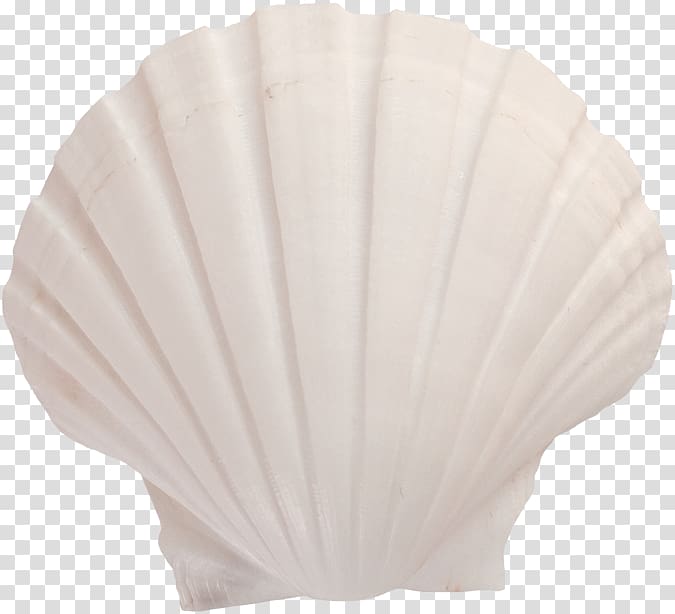
I want to click on slats, so click(x=209, y=290), click(x=140, y=322), click(x=285, y=309), click(x=362, y=301), click(x=437, y=298), click(x=502, y=309), click(x=553, y=332).